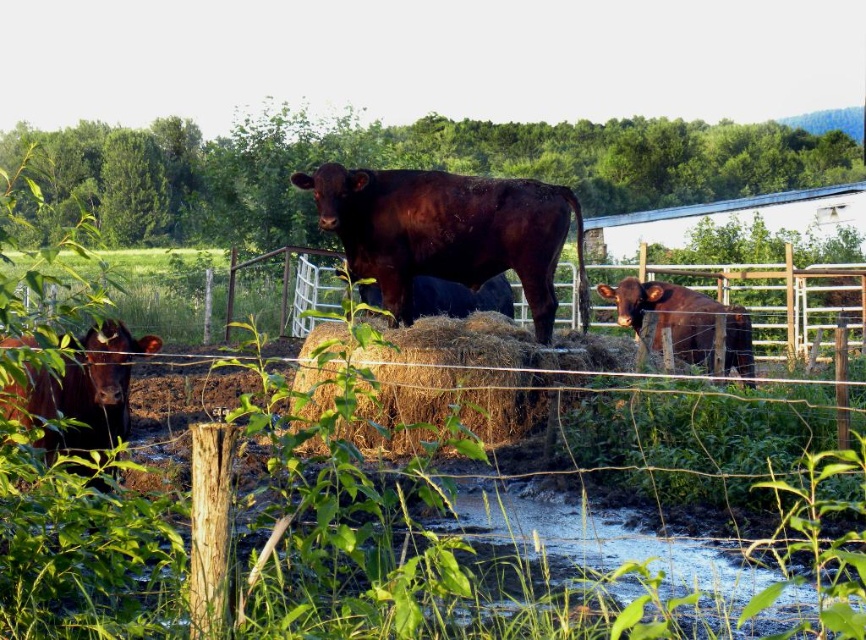
Locate an element on the screen. The height and width of the screenshot is (640, 866). brown hay at center is located at coordinates (391, 480).

Can you confirm if brown hay at center is shorter than shiny brown cow at center?

Yes.

Where is `brown hay at center`? brown hay at center is located at coordinates (391, 480).

Looking at this image, who is more distant from viewer, (267,477) or (467,340)?

The point (467,340) is more distant.

This screenshot has width=866, height=640. Identify the location of brown hay at center. (391, 480).

I want to click on brown hay at center, so 391,480.

Is point (324, 253) closer to camera compared to point (674, 349)?

No, it is not.

Which is behind, point (229, 321) or point (628, 307)?

The point (229, 321) is behind.

This screenshot has height=640, width=866. I want to click on white wire fence at center, so click(214, 291).

Image resolution: width=866 pixels, height=640 pixels. Find the location of `white wire fence at center`. white wire fence at center is located at coordinates (214, 291).